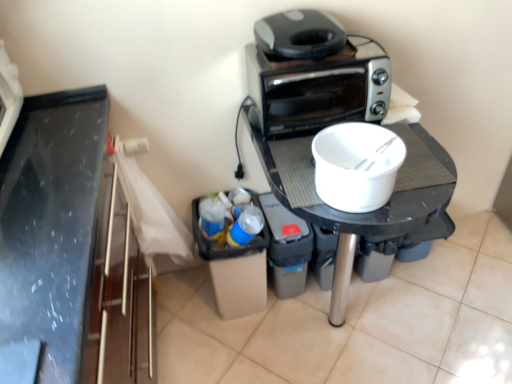
Where is `free space in front of black plastic trash can at lower center`? Image resolution: width=512 pixels, height=384 pixels. free space in front of black plastic trash can at lower center is located at coordinates (296, 325).